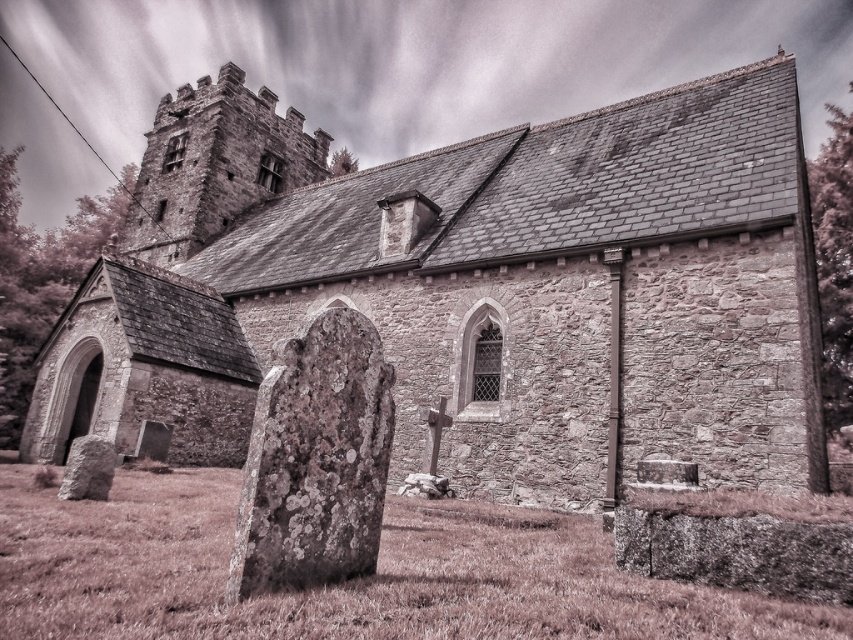
Does lichen-covered stone at center appear on the left side of rusty stone gravestone at lower left?

No, lichen-covered stone at center is not to the left of rusty stone gravestone at lower left.

Can you confirm if lichen-covered stone at center is smaller than rusty stone gravestone at lower left?

No, lichen-covered stone at center is not smaller than rusty stone gravestone at lower left.

What do you see at coordinates (315, 460) in the screenshot? I see `lichen-covered stone at center` at bounding box center [315, 460].

What are the coordinates of `lichen-covered stone at center` in the screenshot? It's located at (315, 460).

Between stone church at center and rusty stone gravestone at lower left, which one appears on the right side from the viewer's perspective?

Positioned to the right is stone church at center.

Who is more distant from viewer, (572,144) or (90,480)?

Positioned behind is point (572,144).

Identify the location of stone church at center. The image size is (853, 640). (515, 280).

Can you confirm if stone church at center is smaller than lichen-covered stone at center?

Actually, stone church at center might be larger than lichen-covered stone at center.

Does stone church at center have a greater height compared to lichen-covered stone at center?

Yes.

You are a GUI agent. You are given a task and a screenshot of the screen. Output one action in this format:
    pyautogui.click(x=<x>, y=<y>)
    Task: Click on the stone church at center
    This screenshot has height=640, width=853.
    Given the screenshot: What is the action you would take?
    pyautogui.click(x=515, y=280)